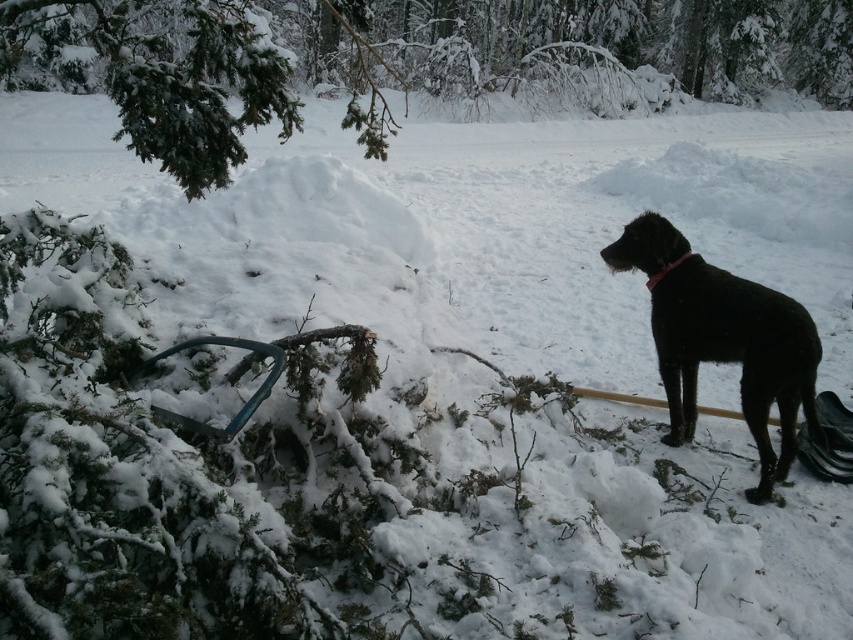
Question: Is green textured pine at upper left to the left of black matte dog at right from the viewer's perspective?

Choices:
 (A) yes
 (B) no

Answer: (B)

Question: Which of the following is the farthest from the observer?

Choices:
 (A) green textured pine at upper left
 (B) black matte dog at right

Answer: (B)

Question: Can you confirm if green textured pine at upper left is bigger than black matte dog at right?

Choices:
 (A) no
 (B) yes

Answer: (B)

Question: Does green textured pine at upper left appear under black matte dog at right?

Choices:
 (A) no
 (B) yes

Answer: (A)